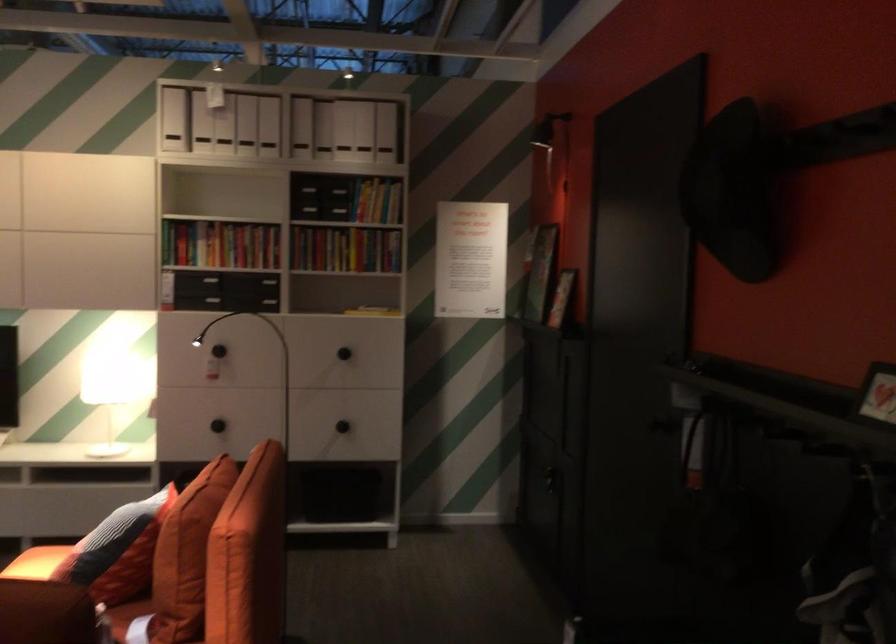
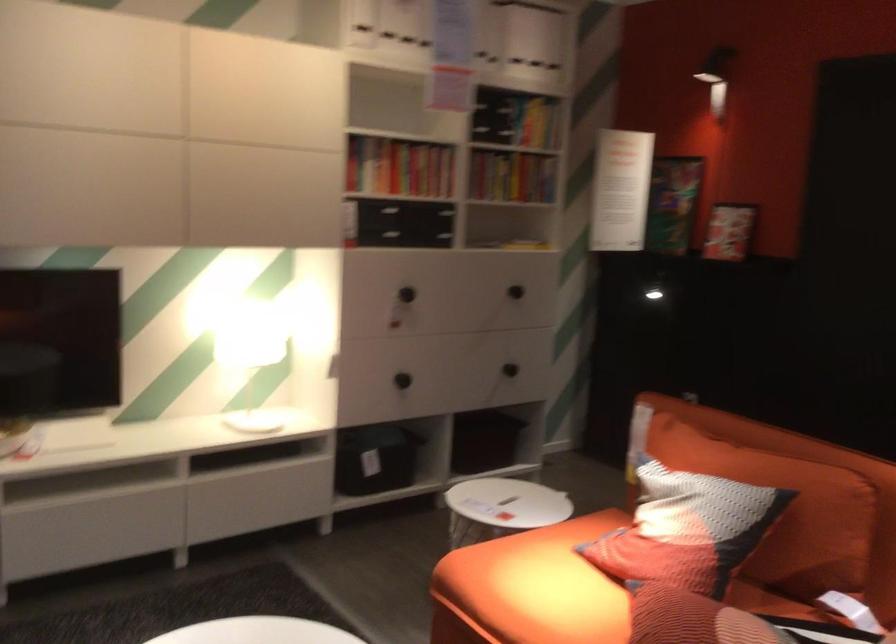
Question: I am providing you with two images of the same scene from different viewpoints. After the viewpoint changes to image2, which objects are now occluded?

Choices:
 (A) black storage bin
 (B) sofa sitting surface
 (C) white magazine file
 (D) none of these

Answer: (D)